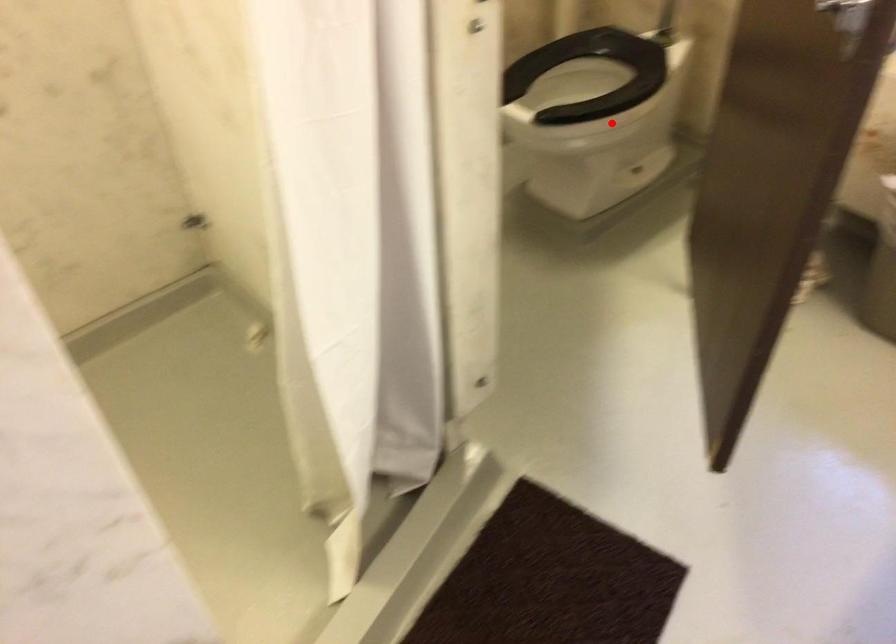
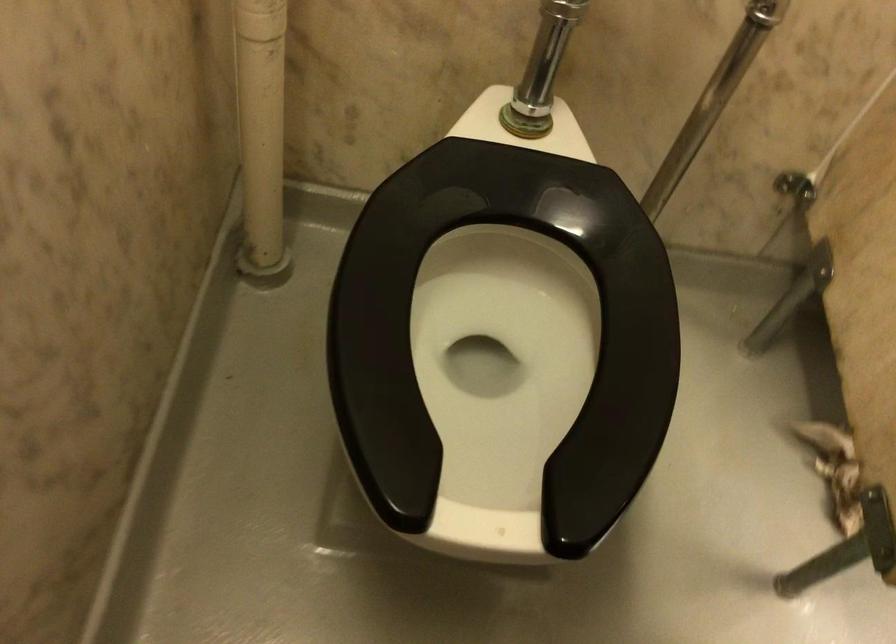
Where in the second image is the point corresponding to the highlighted location from the first image?

(504, 332)